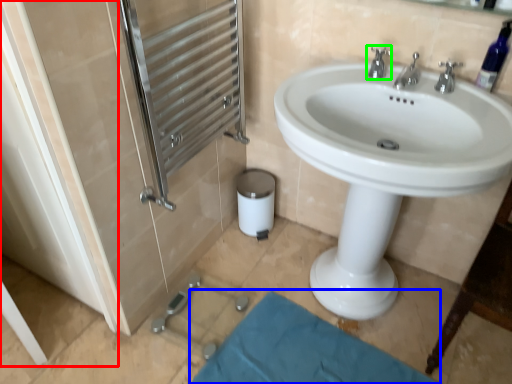
Question: Considering the real-world distances, which object is closest to screen door (highlighted by a red box)? bath mat (highlighted by a blue box) or tap (highlighted by a green box).

Choices:
 (A) bath mat
 (B) tap

Answer: (A)